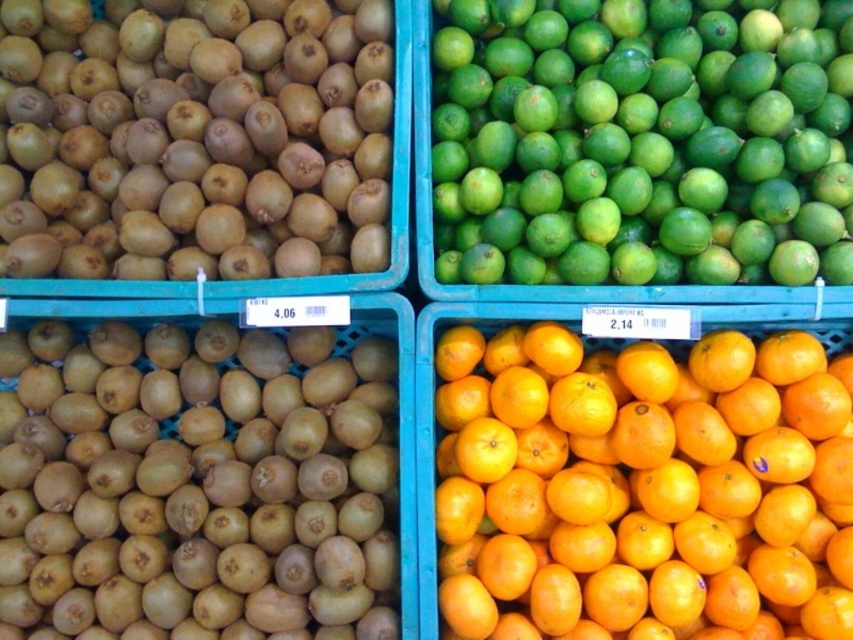
Question: Which point is closer to the camera?

Choices:
 (A) (202, 68)
 (B) (833, 362)

Answer: (B)

Question: Does orange matte/orange at center have a lesser width compared to brown matte kiwi at upper left?

Choices:
 (A) yes
 (B) no

Answer: (A)

Question: Is green matte lime at upper right to the left of brown matte kiwi at upper left from the viewer's perspective?

Choices:
 (A) yes
 (B) no

Answer: (B)

Question: Which object is farther from the camera taking this photo?

Choices:
 (A) green matte lime at upper right
 (B) brown matte kiwi at upper left

Answer: (B)

Question: Which object is farther from the camera taking this photo?

Choices:
 (A) orange matte/orange at center
 (B) green matte lime at upper right

Answer: (B)

Question: Does orange matte/orange at center have a lesser width compared to brown matte kiwi at upper left?

Choices:
 (A) yes
 (B) no

Answer: (A)